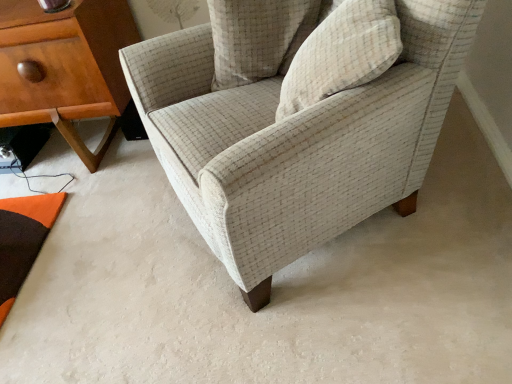
Question: Which direction should I rotate to look at beige textured pillow at upper center, marked as the first pillow in a front-to-back arrangement?

Choices:
 (A) right
 (B) left

Answer: (A)

Question: Does beige textured pillow at upper center, acting as the 2th pillow starting from the back, have a lesser width compared to textured beige armchair at center?

Choices:
 (A) no
 (B) yes

Answer: (B)

Question: Is beige textured pillow at upper center, acting as the 2th pillow starting from the back, positioned far away from textured beige armchair at center?

Choices:
 (A) no
 (B) yes

Answer: (A)

Question: Is the surface of beige textured pillow at upper center, marked as the first pillow in a front-to-back arrangement, in direct contact with textured beige armchair at center?

Choices:
 (A) yes
 (B) no

Answer: (B)

Question: Does beige textured pillow at upper center, acting as the 2th pillow starting from the back, have a larger size compared to textured beige armchair at center?

Choices:
 (A) no
 (B) yes

Answer: (A)

Question: Is beige textured pillow at upper center, marked as the first pillow in a front-to-back arrangement, further to camera compared to textured beige armchair at center?

Choices:
 (A) yes
 (B) no

Answer: (A)

Question: From the image's perspective, is beige textured pillow at upper center, acting as the 2th pillow starting from the back, below textured beige armchair at center?

Choices:
 (A) no
 (B) yes

Answer: (A)

Question: Considering the relative sizes of beige textured pillow at upper center, marked as the first pillow in a front-to-back arrangement, and wooden nightstand at left in the image provided, is beige textured pillow at upper center, marked as the first pillow in a front-to-back arrangement, bigger than wooden nightstand at left?

Choices:
 (A) yes
 (B) no

Answer: (B)

Question: Is beige textured pillow at upper center, marked as the first pillow in a front-to-back arrangement, looking in the opposite direction of wooden nightstand at left?

Choices:
 (A) no
 (B) yes

Answer: (A)

Question: Does beige textured pillow at upper center, marked as the first pillow in a front-to-back arrangement, have a greater height compared to wooden nightstand at left?

Choices:
 (A) no
 (B) yes

Answer: (A)

Question: Is beige textured pillow at upper center, acting as the 2th pillow starting from the back, closer to the viewer compared to wooden nightstand at left?

Choices:
 (A) no
 (B) yes

Answer: (B)

Question: Is beige textured pillow at upper center, marked as the first pillow in a front-to-back arrangement, facing towards wooden nightstand at left?

Choices:
 (A) yes
 (B) no

Answer: (A)

Question: Is beige textured pillow at upper center, marked as the first pillow in a front-to-back arrangement, shorter than wooden nightstand at left?

Choices:
 (A) yes
 (B) no

Answer: (A)

Question: Is wooden nightstand at left taller than beige textured pillow at upper center, placed as the second pillow when sorted from front to back?

Choices:
 (A) no
 (B) yes

Answer: (B)